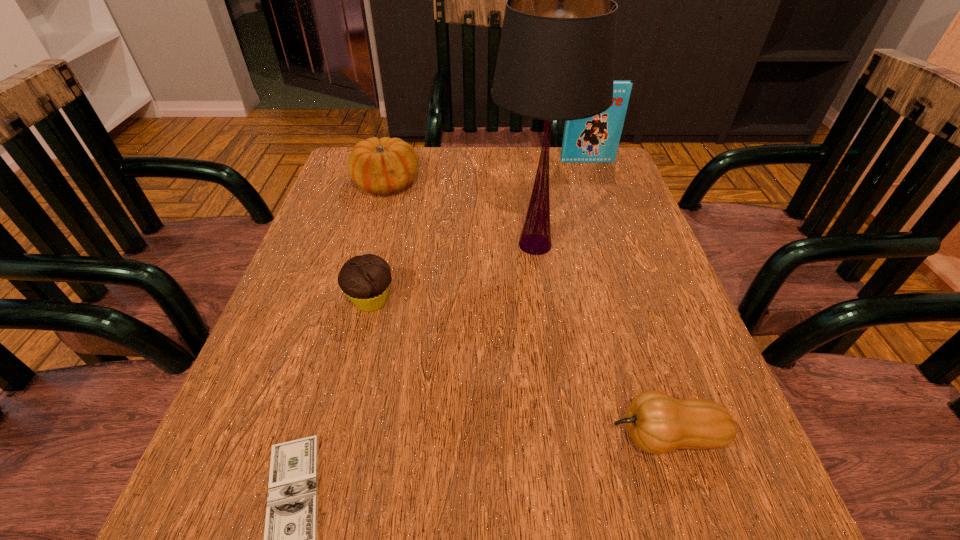
Where is `free space between the farther gourd and the fifth shortest object`? free space between the farther gourd and the fifth shortest object is located at coordinates tap(487, 173).

Identify the location of vacant space that's between the nearer gourd and the fifth shortest object. This screenshot has width=960, height=540. (627, 299).

This screenshot has width=960, height=540. Identify the location of free spot between the farther gourd and the shorter gourd. (526, 310).

Where is `empty space that is in between the muffin and the left gourd`? The width and height of the screenshot is (960, 540). empty space that is in between the muffin and the left gourd is located at coordinates point(378,242).

I want to click on the fifth closest object to the right gourd, so click(x=595, y=139).

Locate an element on the screen. This screenshot has width=960, height=540. the third closest object relative to the right gourd is located at coordinates (366, 279).

This screenshot has height=540, width=960. Find the location of `free space in the image that satisfies the following two spatial constraints: 1. on the front cover of the book; 2. on the stem side of the right gourd`. free space in the image that satisfies the following two spatial constraints: 1. on the front cover of the book; 2. on the stem side of the right gourd is located at coordinates (683, 436).